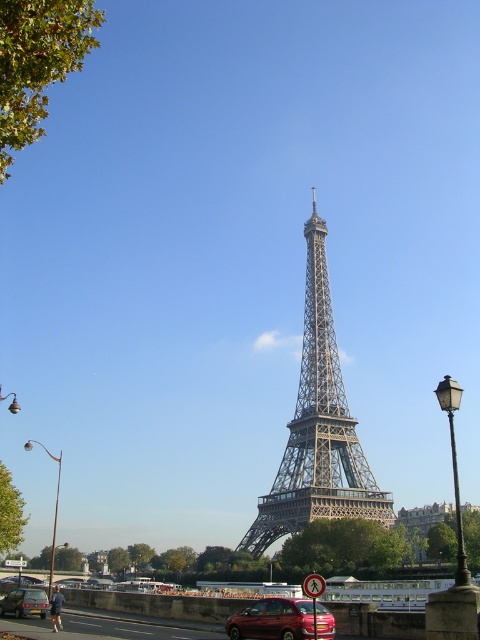
Question: Considering the real-world distances, which object is closest to the metallic red car at center?

Choices:
 (A) metallic silver car at lower left
 (B) metallic structure at center

Answer: (B)

Question: Does metallic red car at center have a larger size compared to metallic silver car at lower left?

Choices:
 (A) no
 (B) yes

Answer: (B)

Question: Considering the real-world distances, which object is closest to the metallic silver car at lower left?

Choices:
 (A) metallic structure at center
 (B) metallic red car at center

Answer: (B)

Question: Can you confirm if metallic structure at center is positioned above metallic red car at center?

Choices:
 (A) no
 (B) yes

Answer: (B)

Question: Does metallic structure at center appear on the right side of metallic silver car at lower left?

Choices:
 (A) yes
 (B) no

Answer: (A)

Question: Considering the real-world distances, which object is farthest from the metallic silver car at lower left?

Choices:
 (A) metallic red car at center
 (B) metallic structure at center

Answer: (B)